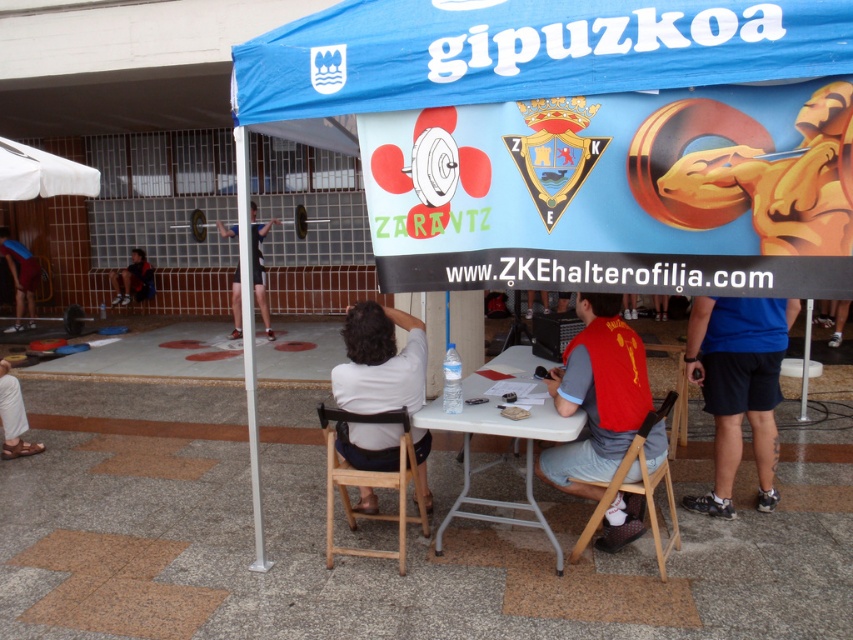
Is red fabric vest at center to the left of blue fabric shorts at lower right from the viewer's perspective?

Correct, you'll find red fabric vest at center to the left of blue fabric shorts at lower right.

Between red fabric vest at center and blue fabric shorts at lower right, which one has less height?

With less height is blue fabric shorts at lower right.

In order to click on red fabric vest at center in this screenshot , I will do `click(596, 396)`.

Who is positioned more to the right, dark blue shirt at center or dark blue shorts at lower left?

Positioned to the right is dark blue shirt at center.

Does dark blue shirt at center have a larger size compared to dark blue shorts at lower left?

Yes.

Is point (260, 275) in front of point (123, 282)?

That is True.

Identify the location of dark blue shirt at center. (260, 266).

Consider the image. Which is above, red fabric vest at center or white fabric shirt at center?

red fabric vest at center is higher up.

Is red fabric vest at center closer to camera compared to white fabric shirt at center?

Yes, it is in front of white fabric shirt at center.

Is point (544, 449) positioned in front of point (416, 330)?

No, it is behind (416, 330).

At what (x,y) coordinates should I click in order to perform the action: click on red fabric vest at center. Please return your answer as a coordinate pair (x, y). The height and width of the screenshot is (640, 853). Looking at the image, I should click on (596, 396).